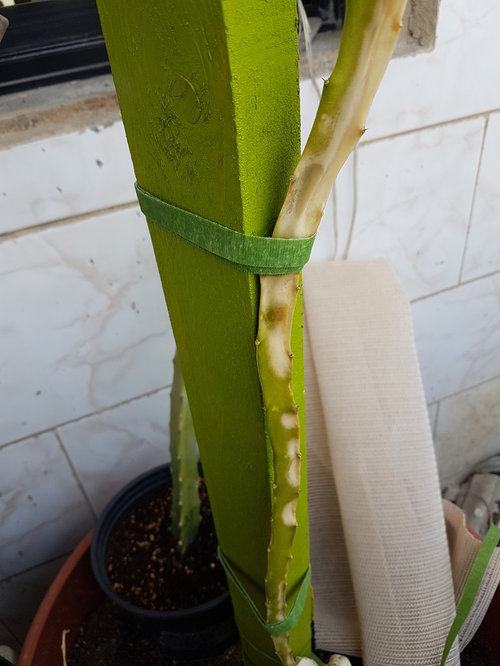
At what (x,y) coordinates should I click in order to perform the action: click on 3 colors on the walls. Please return your answer as a coordinate pair (x, y). The width and height of the screenshot is (500, 666). Looking at the image, I should click on (102, 360), (161, 374), (40, 392).